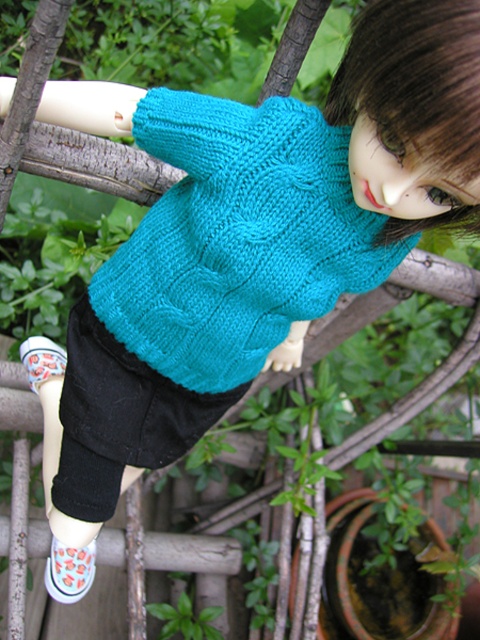
Question: Does teal knitted sweater at upper center appear on the left side of white canvas shoe at lower left?

Choices:
 (A) no
 (B) yes

Answer: (A)

Question: Observing the image, what is the correct spatial positioning of teal knitted sweater at upper center in reference to white canvas shoe at lower left?

Choices:
 (A) right
 (B) left

Answer: (A)

Question: Can you confirm if teal knitted sweater at upper center is bigger than white canvas shoe at lower left?

Choices:
 (A) yes
 (B) no

Answer: (A)

Question: Among these objects, which one is nearest to the camera?

Choices:
 (A) teal knitted sweater at upper center
 (B) white canvas shoe at lower left

Answer: (A)